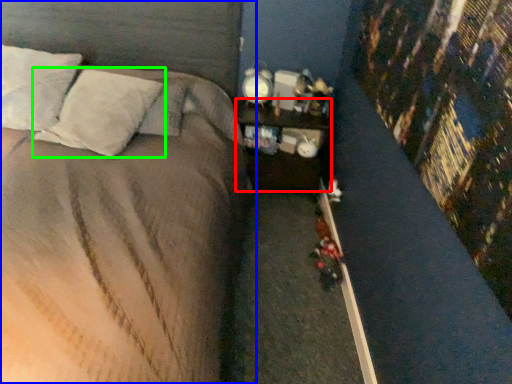
Question: Which is nearer to the nightstand (highlighted by a red box)? bed (highlighted by a blue box) or pillow (highlighted by a green box).

Choices:
 (A) bed
 (B) pillow

Answer: (A)